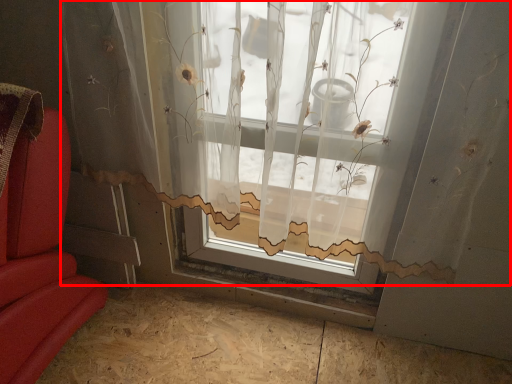
Question: From the image's perspective, considering the relative positions of window (annotated by the red box) and plywood in the image provided, where is window (annotated by the red box) located with respect to the staircase?

Choices:
 (A) below
 (B) above

Answer: (B)